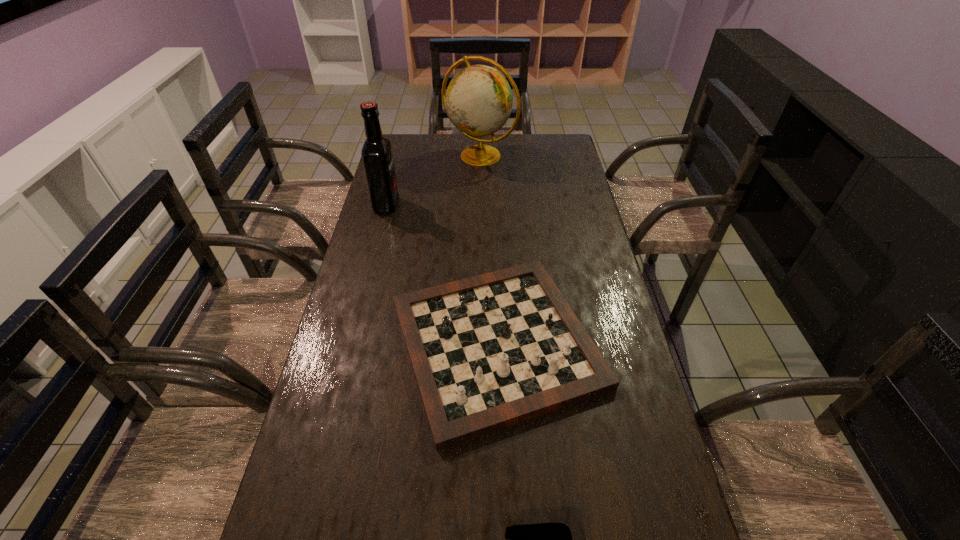
Find the location of `chessboard that is at the left edge`. chessboard that is at the left edge is located at coordinates [489, 351].

Identify the location of object present at the right edge. 489,351.

At what (x,y) coordinates should I click in order to perform the action: click on vacant space at the far edge of the desktop. Please return your answer as a coordinate pair (x, y). This screenshot has width=960, height=540. Looking at the image, I should click on (506, 157).

In the image, there is a desktop. Identify the location of vacant space at the left edge. (402, 183).

Locate an element on the screen. vacant region at the right edge is located at coordinates (568, 201).

I want to click on vacant space at the far left corner of the desktop, so point(413,146).

Where is `free space that is in between the farthest object and the third farthest object`? The width and height of the screenshot is (960, 540). free space that is in between the farthest object and the third farthest object is located at coordinates (489, 249).

Locate an element on the screen. This screenshot has height=540, width=960. free space that is in between the leftmost object and the second nearest object is located at coordinates (442, 274).

Locate an element on the screen. This screenshot has height=540, width=960. empty location between the globe and the chessboard is located at coordinates (489, 249).

Identify which object is the second nearest to the second nearest object. Please provide its 2D coordinates. Your answer should be formatted as a tuple, i.e. [(x, y)], where the tuple contains the x and y coordinates of a point satisfying the conditions above.

[(376, 152)]